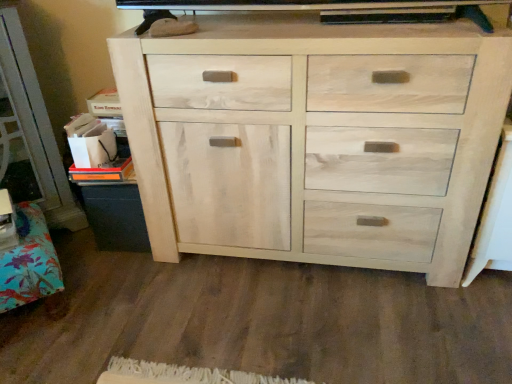
You are a GUI agent. You are given a task and a screenshot of the screen. Output one action in this format:
    pyautogui.click(x=<x>, y=<y>)
    Task: Click on the natural wood cabinet at center
    
    Given the screenshot: What is the action you would take?
    pyautogui.click(x=315, y=139)

The height and width of the screenshot is (384, 512). Describe the element at coordinates (315, 139) in the screenshot. I see `natural wood cabinet at center` at that location.

What is the approximate width of natural wood cabinet at center?

The width of natural wood cabinet at center is 19.05 inches.

Where is `natural wood cabinet at lower left`? This screenshot has width=512, height=384. natural wood cabinet at lower left is located at coordinates tap(29, 262).

What is the approximate height of natural wood cabinet at lower left?

natural wood cabinet at lower left is 8.66 inches in height.

What do you see at coordinates (29, 262) in the screenshot? I see `natural wood cabinet at lower left` at bounding box center [29, 262].

At what (x,y) coordinates should I click in order to perform the action: click on natural wood cabinet at center. Please return your answer as a coordinate pair (x, y). Image resolution: width=512 pixels, height=384 pixels. Looking at the image, I should click on (315, 139).

Is natural wood cabinet at center at the left side of natural wood cabinet at lower left?

In fact, natural wood cabinet at center is to the right of natural wood cabinet at lower left.

Which object is more forward, natural wood cabinet at center or natural wood cabinet at lower left?

natural wood cabinet at center is more forward.

Is point (490, 125) positioned before point (31, 222)?

That is True.

From the image's perspective, which is above, natural wood cabinet at center or natural wood cabinet at lower left?

natural wood cabinet at center, from the image's perspective.

From a real-world perspective, is natural wood cabinet at center positioned above or below natural wood cabinet at lower left?

From a real-world perspective, natural wood cabinet at center is physically above natural wood cabinet at lower left.

Considering the sizes of objects natural wood cabinet at center and natural wood cabinet at lower left in the image provided, who is wider, natural wood cabinet at center or natural wood cabinet at lower left?

With larger width is natural wood cabinet at lower left.

Considering the sizes of objects natural wood cabinet at center and natural wood cabinet at lower left in the image provided, who is taller, natural wood cabinet at center or natural wood cabinet at lower left?

With more height is natural wood cabinet at center.

In terms of size, does natural wood cabinet at center appear bigger or smaller than natural wood cabinet at lower left?

In the image, natural wood cabinet at center appears to be larger than natural wood cabinet at lower left.

Choose the correct answer: Is natural wood cabinet at center inside natural wood cabinet at lower left or outside it?

natural wood cabinet at center lies outside natural wood cabinet at lower left.

Is natural wood cabinet at center placed right next to natural wood cabinet at lower left?

No, natural wood cabinet at center is not with natural wood cabinet at lower left.

From the picture: Is natural wood cabinet at lower left at the back of natural wood cabinet at center?

That's not correct — natural wood cabinet at center is not looking away from natural wood cabinet at lower left.

Can you tell me how much natural wood cabinet at center and natural wood cabinet at lower left differ in facing direction?

41.2 degrees separate the facing orientations of natural wood cabinet at center and natural wood cabinet at lower left.

The image size is (512, 384). Find the location of `cabinetry below the natural wood cabinet at center (from a real-world perspective)`. cabinetry below the natural wood cabinet at center (from a real-world perspective) is located at coordinates (29, 262).

Consider the image. Can you confirm if natural wood cabinet at lower left is positioned to the right of natural wood cabinet at center?

No.

Considering the relative positions of natural wood cabinet at lower left and natural wood cabinet at center in the image provided, is natural wood cabinet at lower left in front of natural wood cabinet at center?

That is False.

Is point (15, 291) positioned in front of point (272, 258)?

That is True.

From the image's perspective, would you say natural wood cabinet at lower left is shown under natural wood cabinet at center?

Yes.

From a real-world perspective, is natural wood cabinet at lower left located higher than natural wood cabinet at center?

No, from a real-world perspective, natural wood cabinet at lower left is not over natural wood cabinet at center

Considering the sizes of natural wood cabinet at lower left and natural wood cabinet at center in the image, is natural wood cabinet at lower left wider or thinner than natural wood cabinet at center?

Clearly, natural wood cabinet at lower left has more width compared to natural wood cabinet at center.

Who is shorter, natural wood cabinet at lower left or natural wood cabinet at center?

Standing shorter between the two is natural wood cabinet at lower left.

Which of these two, natural wood cabinet at lower left or natural wood cabinet at center, is smaller?

natural wood cabinet at lower left is smaller.

Is natural wood cabinet at lower left not within natural wood cabinet at center?

Yes.

Is there a large distance between natural wood cabinet at lower left and natural wood cabinet at center?

Actually, natural wood cabinet at lower left and natural wood cabinet at center are a little close together.

Is natural wood cabinet at lower left looking in the opposite direction of natural wood cabinet at center?

natural wood cabinet at lower left does not have its back to natural wood cabinet at center.

What's the angular difference between natural wood cabinet at lower left and natural wood cabinet at center's facing directions?

The angle between the facing direction of natural wood cabinet at lower left and the facing direction of natural wood cabinet at center is 41.2 degrees.

Locate an element on the screen. This screenshot has height=384, width=512. cabinetry on the left of natural wood cabinet at center is located at coordinates (29, 262).

In order to click on cabinetry that is behind the natural wood cabinet at center in this screenshot , I will do `click(29, 262)`.

Locate an element on the screen. The width and height of the screenshot is (512, 384). chest of drawers above the natural wood cabinet at lower left (from a real-world perspective) is located at coordinates (315, 139).